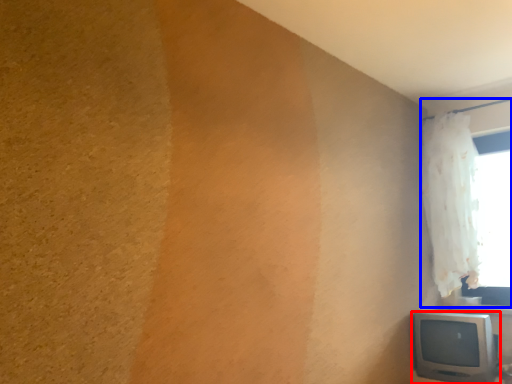
Question: Which object appears farthest to the camera in this image, television (highlighted by a red box) or window (highlighted by a blue box)?

Choices:
 (A) television
 (B) window

Answer: (B)